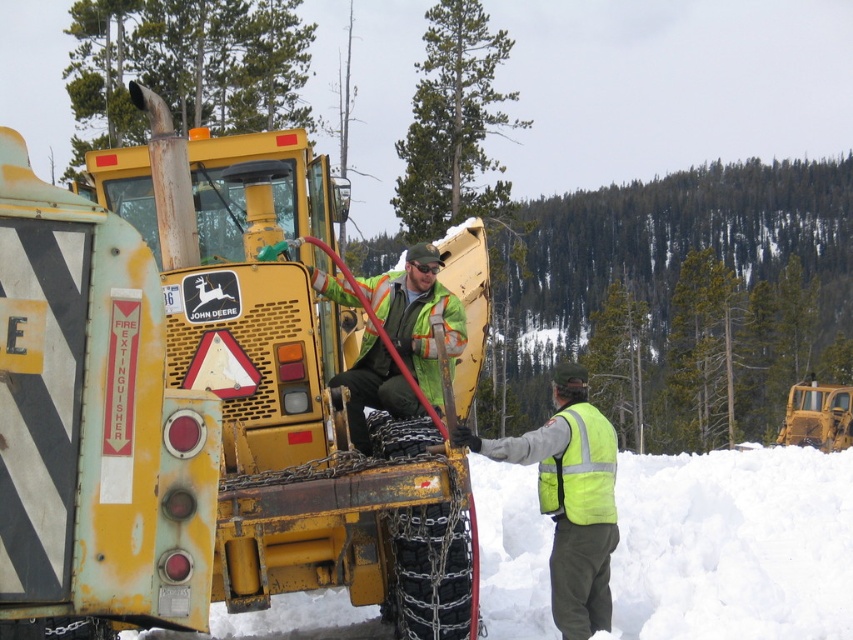
Based on the photo, you are standing at the point marked as point (186,408) in the snowy scene. What object is exactly at that point?

The yellow matte tractor at center is exactly at point (186,408).

In the scene shown: You are standing in the snowy scene and want to take a photo of the snowplow. Which of the two points, point (65, 632) or point (688, 541), would be closer to the camera to ensure the main subject is in focus?

Point (65, 632) is closer to the camera than point (688, 541), so focusing on point (65, 632) would ensure the main subject is in focus.